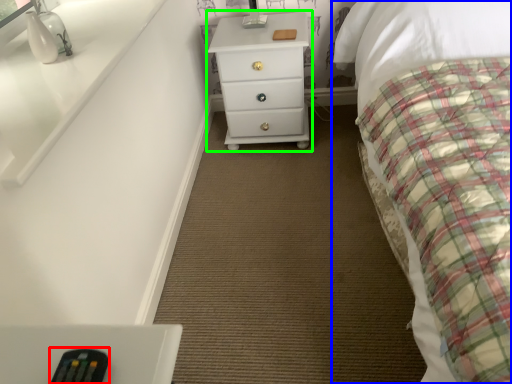
Question: Which is nearer to the remote (highlighted by a red box)? bed (highlighted by a blue box) or chest of drawers (highlighted by a green box).

Choices:
 (A) bed
 (B) chest of drawers

Answer: (A)